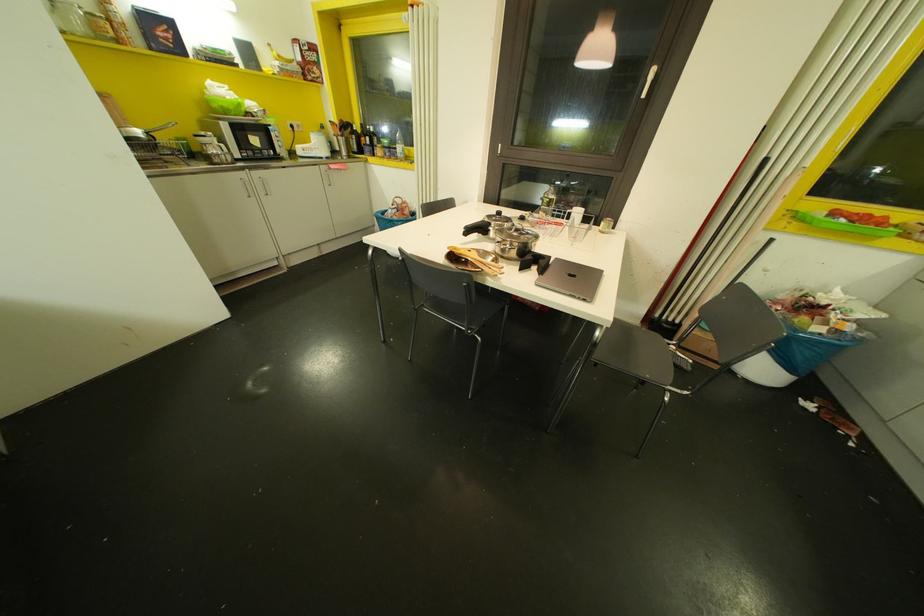
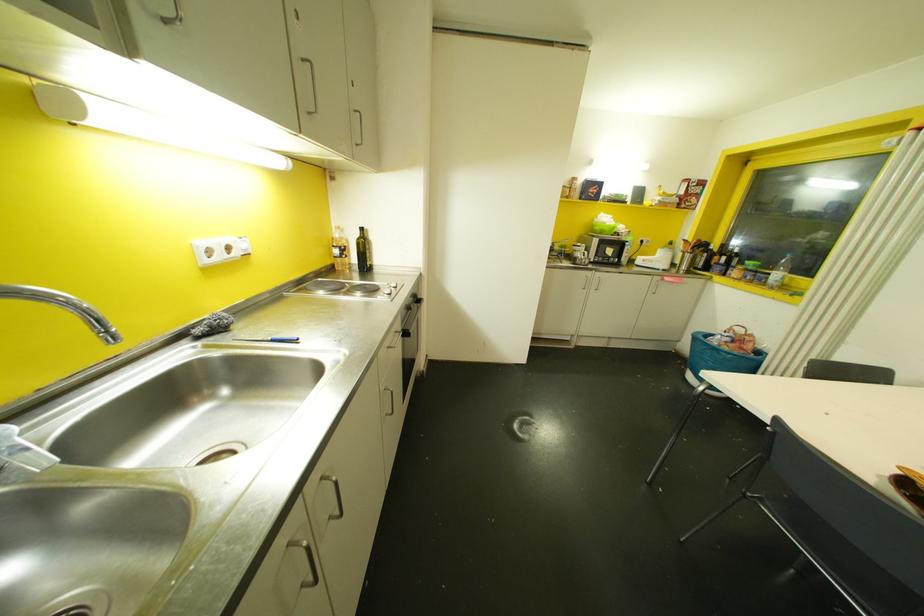
The point at (261, 191) is marked in the first image. Where is the corresponding point in the second image?

(592, 286)